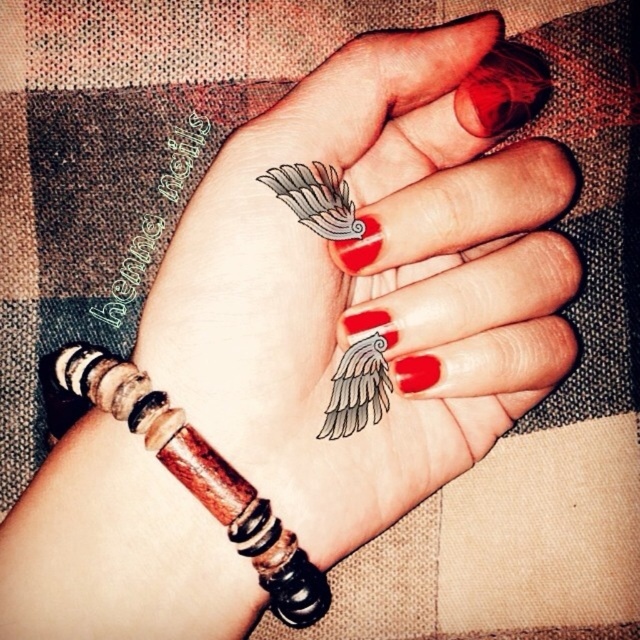
Between wooden beaded bracelet at lower left and gray ink wing at center, which one appears on the right side from the viewer's perspective?

gray ink wing at center

Can you confirm if wooden beaded bracelet at lower left is positioned below gray ink wing at center?

Yes, wooden beaded bracelet at lower left is below gray ink wing at center.

Which is in front, point (176, 440) or point (356, 408)?

Point (176, 440) is in front.

In order to click on wooden beaded bracelet at lower left in this screenshot , I will do `click(192, 472)`.

Who is positioned more to the left, gray ink wing at center or white matte wing at center?

Positioned to the left is white matte wing at center.

Is gray ink wing at center to the left of white matte wing at center from the viewer's perspective?

No, gray ink wing at center is not to the left of white matte wing at center.

This screenshot has height=640, width=640. What do you see at coordinates (356, 388) in the screenshot? I see `gray ink wing at center` at bounding box center [356, 388].

This screenshot has width=640, height=640. Identify the location of gray ink wing at center. (356, 388).

Is wooden beaded bracelet at lower left shorter than white matte wing at center?

In fact, wooden beaded bracelet at lower left may be taller than white matte wing at center.

Is point (317, 608) positioned behind point (314, 198)?

Yes, point (317, 608) is behind point (314, 198).

The height and width of the screenshot is (640, 640). I want to click on wooden beaded bracelet at lower left, so click(x=192, y=472).